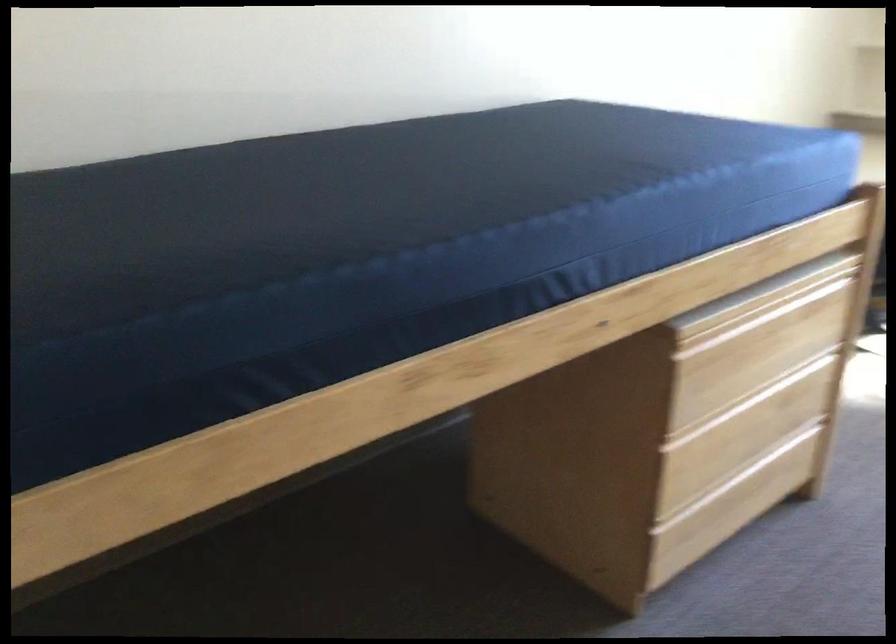
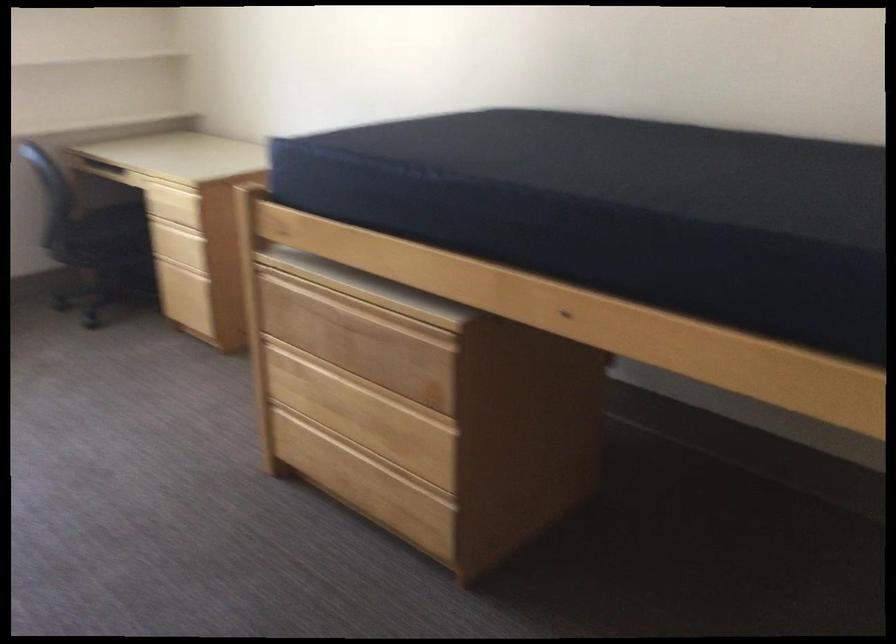
First-person continuous shooting, in which direction is the camera rotating?

The camera rotated toward right-down.